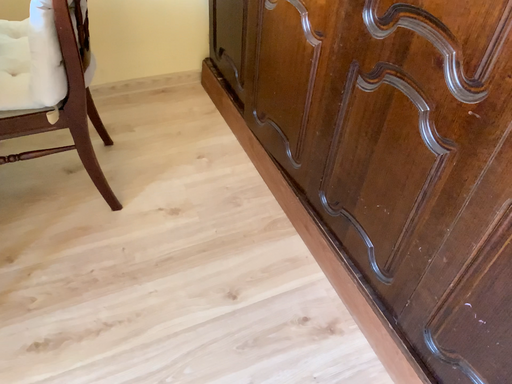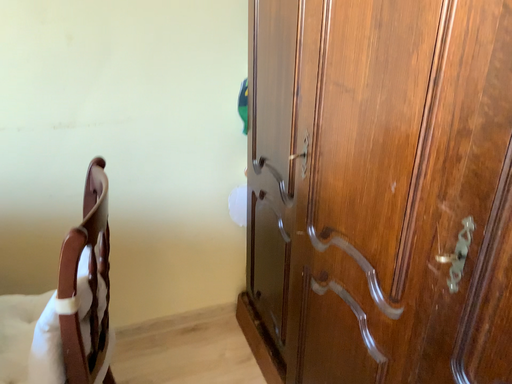
Question: How did the camera likely rotate when shooting the video?

Choices:
 (A) rotated upward
 (B) rotated downward

Answer: (A)